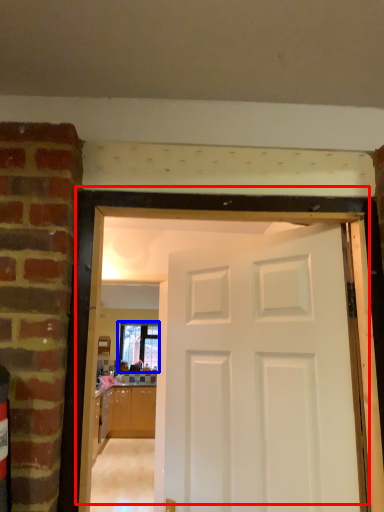
Question: Which object appears closest to the camera in this image, door (highlighted by a red box) or window (highlighted by a blue box)?

Choices:
 (A) door
 (B) window

Answer: (A)